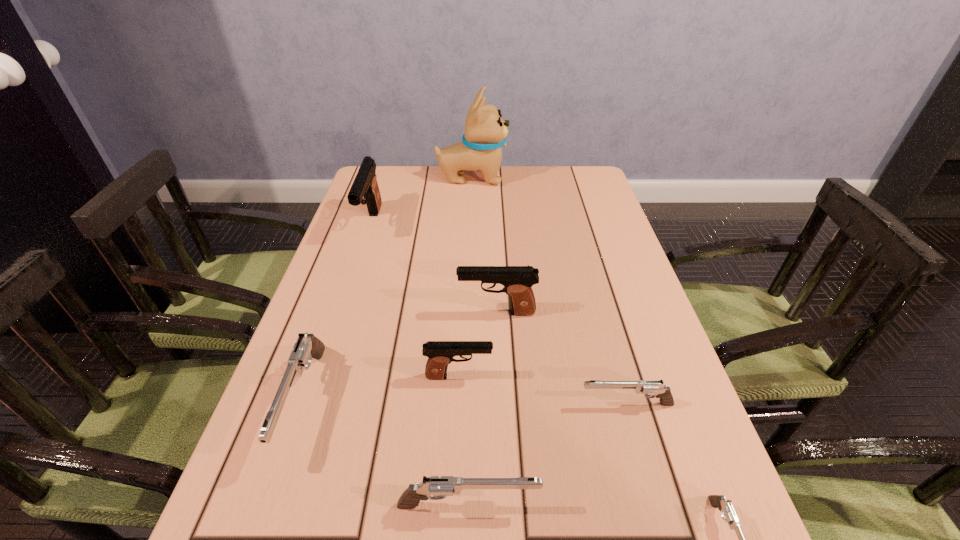
Locate an element on the screen. The width and height of the screenshot is (960, 540). vacant area located on the front-facing side of the seventh tallest object is located at coordinates (381, 404).

The image size is (960, 540). I want to click on free space located 0.070m on the front-facing side of the seventh tallest object, so click(x=543, y=404).

The image size is (960, 540). Identify the location of vacant region located on the front-facing side of the seventh tallest object. (486, 404).

This screenshot has height=540, width=960. I want to click on object at the far edge, so click(485, 132).

At what (x,y) coordinates should I click in order to perform the action: click on object that is at the right edge. Please return your answer as a coordinate pair (x, y). This screenshot has height=540, width=960. Looking at the image, I should click on (656, 387).

In the image, there is a desktop. Identify the location of vacant space at the far edge. (468, 200).

In the image, there is a desktop. Where is `vacant space at the left edge`? This screenshot has height=540, width=960. vacant space at the left edge is located at coordinates (351, 284).

Find the location of `vacant space at the right edge of the desktop`. vacant space at the right edge of the desktop is located at coordinates (623, 411).

Identify the location of free space at the far left corner. (392, 184).

At what (x,y) coordinates should I click in order to perform the action: click on vacant region at the far right corner of the desktop. Please return your answer as a coordinate pair (x, y). The height and width of the screenshot is (540, 960). Looking at the image, I should click on (573, 177).